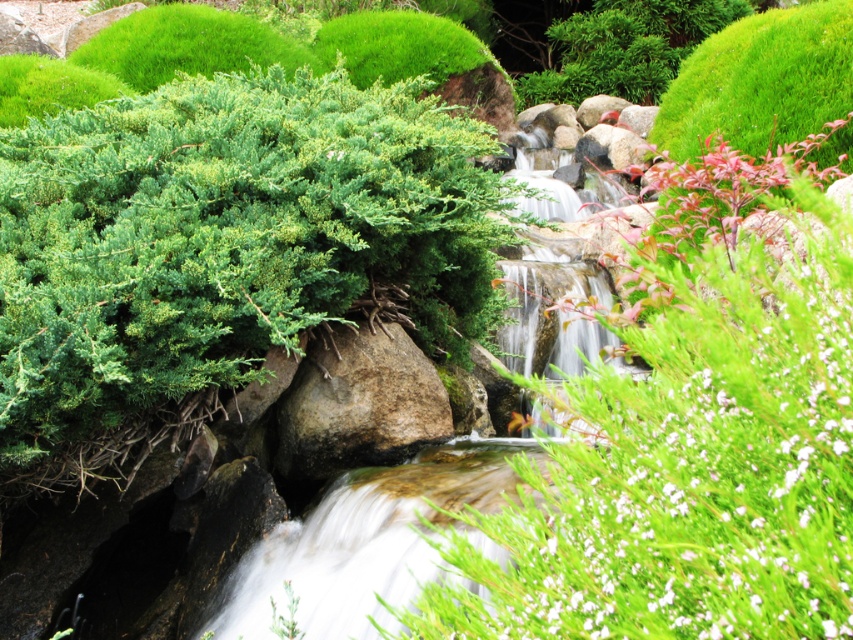
Between point (62, 465) and point (802, 557), which one is positioned in front?

Point (802, 557)

Can you confirm if green leafy bush at left is positioned above green fuzzy bush at center?

Correct, green leafy bush at left is located above green fuzzy bush at center.

Describe the element at coordinates (219, 248) in the screenshot. The width and height of the screenshot is (853, 640). I see `green leafy bush at left` at that location.

Identify the location of green leafy bush at left. (219, 248).

Is point (375, 260) behind point (636, 28)?

That is False.

The width and height of the screenshot is (853, 640). Describe the element at coordinates (219, 248) in the screenshot. I see `green leafy bush at left` at that location.

Identify the location of green leafy bush at left. (219, 248).

Which is more to the right, green leafy bush at left or brown rough rock at center?

brown rough rock at center

You are a GUI agent. You are given a task and a screenshot of the screen. Output one action in this format:
    pyautogui.click(x=<x>, y=<y>)
    Task: Click on the green leafy bush at left
    
    Given the screenshot: What is the action you would take?
    pyautogui.click(x=219, y=248)

The width and height of the screenshot is (853, 640). Identify the location of green leafy bush at left. (219, 248).